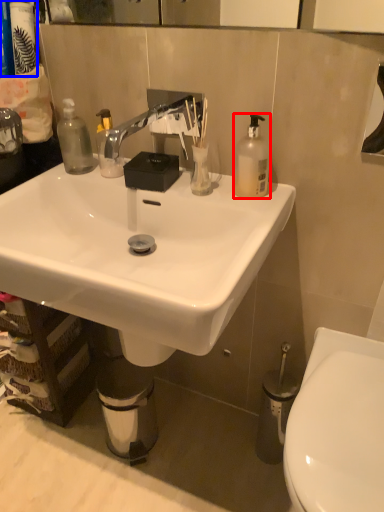
Question: Which object is further to the camera taking this photo, bottle (highlighted by a red box) or toiletries (highlighted by a blue box)?

Choices:
 (A) bottle
 (B) toiletries

Answer: (B)